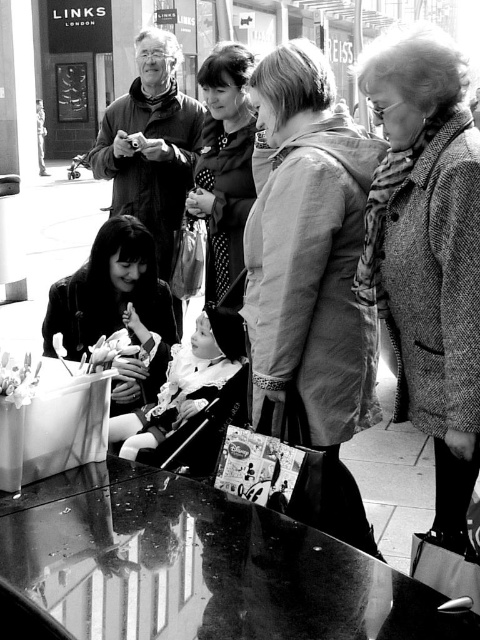
Question: Which of the following is the farthest from the observer?

Choices:
 (A) (33, 376)
 (B) (51, 324)

Answer: (B)

Question: From the image, what is the correct spatial relationship of coarse wool coat at right in relation to white paper napkin at lower left?

Choices:
 (A) above
 (B) below

Answer: (A)

Question: Can you confirm if matte black jacket at upper left is positioned below white paper napkin at lower left?

Choices:
 (A) no
 (B) yes

Answer: (A)

Question: Which point appears closest to the camera in this image?

Choices:
 (A) (97, 161)
 (B) (324, 272)
 (C) (17, 365)

Answer: (C)

Question: Can you confirm if textured beige coat at center is thinner than matte black jacket at upper left?

Choices:
 (A) yes
 (B) no

Answer: (A)

Question: Which is farther from the matte black jacket at upper left?

Choices:
 (A) polka dot fabric dress at center
 (B) smooth skin woman at center
 (C) glass table at lower left

Answer: (C)